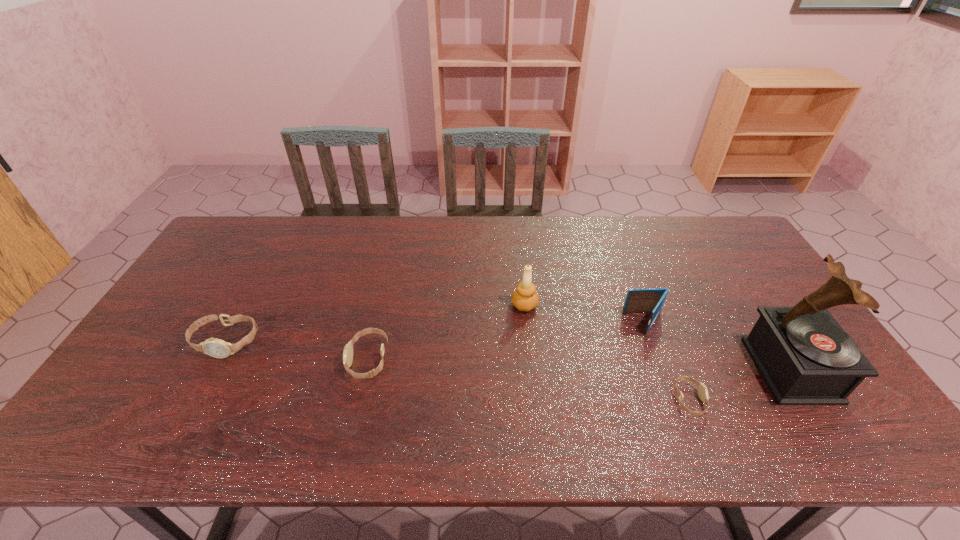
Where is `the leftmost watch`? This screenshot has height=540, width=960. the leftmost watch is located at coordinates tap(217, 348).

I want to click on the fifth object from right to left, so point(348,349).

Locate an element on the screen. the second shortest watch is located at coordinates (348, 349).

Find the location of a particular element. This screenshot has height=540, width=960. the rightmost watch is located at coordinates (702, 389).

Locate an element on the screen. The width and height of the screenshot is (960, 540). the shortest object is located at coordinates (702, 389).

Where is `the fourth object from right to left`? The image size is (960, 540). the fourth object from right to left is located at coordinates (524, 298).

Identify the location of candle_holder. Image resolution: width=960 pixels, height=540 pixels. (524, 298).

Identify the location of the third tallest object. (652, 300).

Identify the location of phonograph_record. This screenshot has width=960, height=540. (805, 357).

Identify the location of the rightmost object. (805, 357).